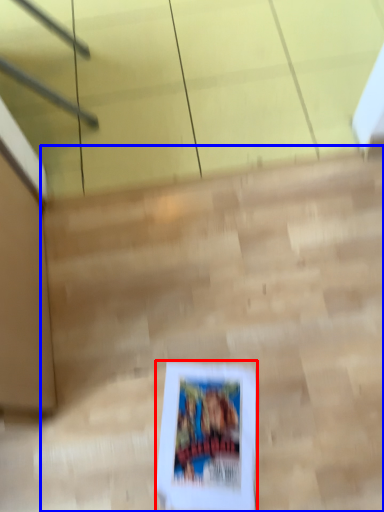
Question: Which object is closer to the camera taking this photo, picture frame (highlighted by a red box) or stairwell (highlighted by a blue box)?

Choices:
 (A) picture frame
 (B) stairwell

Answer: (B)